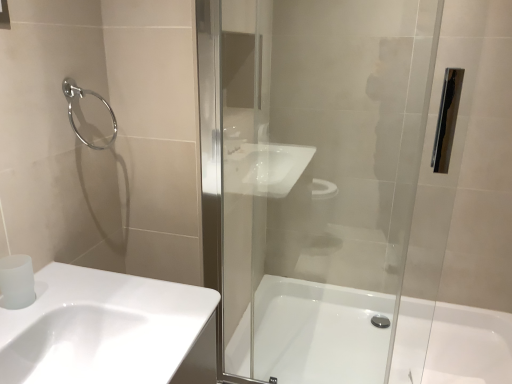
Image resolution: width=512 pixels, height=384 pixels. What are the coordinates of `transparent glass shower door at center` in the screenshot? It's located at (324, 187).

Image resolution: width=512 pixels, height=384 pixels. What do you see at coordinates (16, 281) in the screenshot? I see `satin white toilet paper at lower left` at bounding box center [16, 281].

This screenshot has width=512, height=384. What are the coordinates of `chrome metallic towel ring at upper left` in the screenshot? It's located at (72, 110).

Image resolution: width=512 pixels, height=384 pixels. Find the location of `white glossy bathtub at center`. white glossy bathtub at center is located at coordinates (318, 332).

Considering the relative sizes of white glossy sink at lower left and transparent glass shower door at center in the image provided, is white glossy sink at lower left thinner than transparent glass shower door at center?

No.

Consider the image. Is white glossy sink at lower left further to the viewer compared to transparent glass shower door at center?

No, white glossy sink at lower left is closer to the camera.

From the image's perspective, is white glossy sink at lower left on transparent glass shower door at center?

No.

Image resolution: width=512 pixels, height=384 pixels. Identify the location of screen door lying behind the white glossy sink at lower left. (324, 187).

Is white glossy sink at lower left not inside chrome metallic towel ring at upper left?

white glossy sink at lower left lies outside chrome metallic towel ring at upper left's area.

Looking at this image, is white glossy sink at lower left bigger or smaller than chrome metallic towel ring at upper left?

white glossy sink at lower left is bigger than chrome metallic towel ring at upper left.

Can you see white glossy sink at lower left touching chrome metallic towel ring at upper left?

No, white glossy sink at lower left is not beside chrome metallic towel ring at upper left.

Is white glossy sink at lower left in front of or behind chrome metallic towel ring at upper left in the image?

white glossy sink at lower left is positioned closer to the viewer than chrome metallic towel ring at upper left.

Is transparent glass shower door at center taller than white glossy bathtub at center?

Indeed, transparent glass shower door at center has a greater height compared to white glossy bathtub at center.

How many degrees apart are the facing directions of transparent glass shower door at center and white glossy bathtub at center?

transparent glass shower door at center and white glossy bathtub at center are facing 1.02 degrees away from each other.

Considering the sizes of objects transparent glass shower door at center and white glossy bathtub at center in the image provided, who is smaller, transparent glass shower door at center or white glossy bathtub at center?

transparent glass shower door at center.

Considering the positions of point (338, 158) and point (496, 336), is point (338, 158) closer or farther from the camera than point (496, 336)?

Point (338, 158) is farther from the camera than point (496, 336).

The height and width of the screenshot is (384, 512). What are the coordinates of `sink below the satin white toilet paper at lower left (from a real-world perspective)` in the screenshot? It's located at tap(108, 330).

Is white glossy sink at lower left smaller than satin white toilet paper at lower left?

Actually, white glossy sink at lower left might be larger than satin white toilet paper at lower left.

Is the surface of white glossy sink at lower left in direct contact with satin white toilet paper at lower left?

No, white glossy sink at lower left is not making contact with satin white toilet paper at lower left.

Is white glossy bathtub at center at the back of satin white toilet paper at lower left?

No, satin white toilet paper at lower left's orientation is not away from white glossy bathtub at center.

Is satin white toilet paper at lower left not near white glossy bathtub at center?

Absolutely, satin white toilet paper at lower left is distant from white glossy bathtub at center.

Looking at the image, does satin white toilet paper at lower left seem bigger or smaller compared to white glossy bathtub at center?

Considering their sizes, satin white toilet paper at lower left takes up less space than white glossy bathtub at center.

Which is more to the left, satin white toilet paper at lower left or white glossy bathtub at center?

Positioned to the left is satin white toilet paper at lower left.

Is transparent glass shower door at center beside satin white toilet paper at lower left?

They are not placed beside each other.

Is transparent glass shower door at center smaller than satin white toilet paper at lower left?

Actually, transparent glass shower door at center might be larger than satin white toilet paper at lower left.

Is transparent glass shower door at center taller or shorter than satin white toilet paper at lower left?

transparent glass shower door at center is taller than satin white toilet paper at lower left.

In terms of width, does transparent glass shower door at center look wider or thinner when compared to satin white toilet paper at lower left?

Clearly, transparent glass shower door at center has less width compared to satin white toilet paper at lower left.

Is chrome metallic towel ring at upper left beside transparent glass shower door at center?

No, chrome metallic towel ring at upper left is not with transparent glass shower door at center.

Looking at this image, considering the positions of objects chrome metallic towel ring at upper left and transparent glass shower door at center in the image provided, who is more to the right, chrome metallic towel ring at upper left or transparent glass shower door at center?

transparent glass shower door at center is more to the right.

Which point is more distant from viewer, (82, 138) or (409, 62)?

Positioned behind is point (82, 138).

Can you confirm if chrome metallic towel ring at upper left is wider than transparent glass shower door at center?

Yes.

Where is `screen door lying on the right of white glossy sink at lower left`? This screenshot has height=384, width=512. screen door lying on the right of white glossy sink at lower left is located at coordinates (324, 187).

You are a GUI agent. You are given a task and a screenshot of the screen. Output one action in this format:
    pyautogui.click(x=<x>, y=<y>)
    Task: Click on the sink lying in front of the chrome metallic towel ring at upper left
    This screenshot has height=384, width=512.
    Given the screenshot: What is the action you would take?
    pyautogui.click(x=108, y=330)

From the image, which object appears to be nearer to transparent glass shower door at center, satin white toilet paper at lower left or white glossy bathtub at center?

white glossy bathtub at center is positioned closer to the anchor transparent glass shower door at center.

Considering their positions, is satin white toilet paper at lower left positioned further to white glossy bathtub at center than white glossy sink at lower left?

Among the two, satin white toilet paper at lower left is located further to white glossy bathtub at center.

When comparing their distances from white glossy sink at lower left, does chrome metallic towel ring at upper left or transparent glass shower door at center seem closer?

chrome metallic towel ring at upper left.

Considering their positions, is white glossy sink at lower left positioned closer to white glossy bathtub at center than chrome metallic towel ring at upper left?

white glossy sink at lower left lies closer to white glossy bathtub at center than the other object.

Which object lies nearer to the anchor point transparent glass shower door at center, chrome metallic towel ring at upper left or satin white toilet paper at lower left?

The object closer to transparent glass shower door at center is chrome metallic towel ring at upper left.

Estimate the real-world distances between objects in this image. Which object is closer to chrome metallic towel ring at upper left, white glossy sink at lower left or satin white toilet paper at lower left?

The object closer to chrome metallic towel ring at upper left is satin white toilet paper at lower left.

Which object lies further to the anchor point satin white toilet paper at lower left, chrome metallic towel ring at upper left or transparent glass shower door at center?

transparent glass shower door at center lies further to satin white toilet paper at lower left than the other object.

Looking at the image, which one is located further to chrome metallic towel ring at upper left, white glossy bathtub at center or white glossy sink at lower left?

white glossy bathtub at center is positioned further to the anchor chrome metallic towel ring at upper left.

Find the location of `sink between chrome metallic towel ring at upper left and white glossy bathtub at center in the horizontal direction`. sink between chrome metallic towel ring at upper left and white glossy bathtub at center in the horizontal direction is located at coordinates (108, 330).

The height and width of the screenshot is (384, 512). What are the coordinates of `shower situated between satin white toilet paper at lower left and white glossy bathtub at center from left to right` in the screenshot? It's located at (72, 110).

Find the location of a particular element. The width and height of the screenshot is (512, 384). toilet paper between chrome metallic towel ring at upper left and white glossy sink at lower left in the up-down direction is located at coordinates (16, 281).

The image size is (512, 384). Find the location of `sink between chrome metallic towel ring at upper left and transparent glass shower door at center from left to right`. sink between chrome metallic towel ring at upper left and transparent glass shower door at center from left to right is located at coordinates (108, 330).